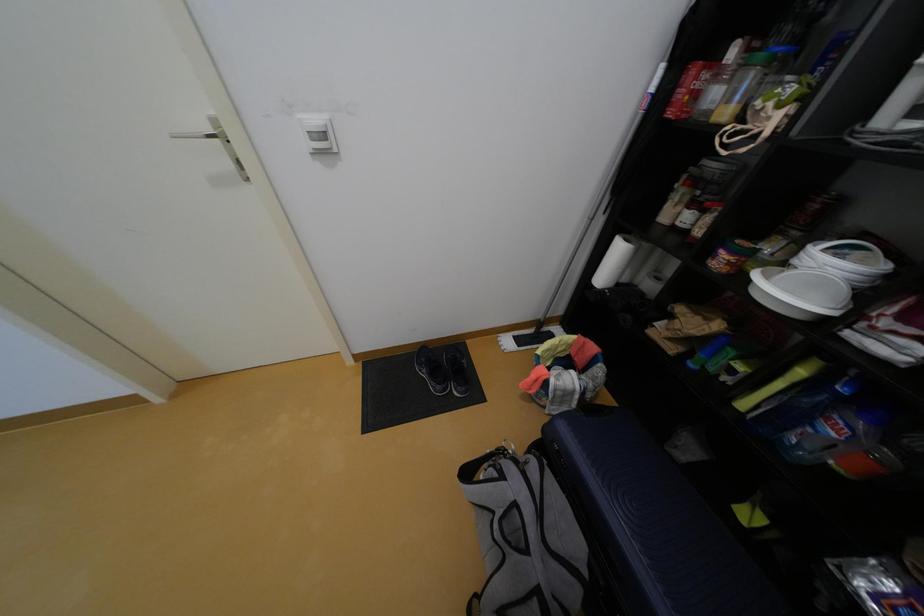
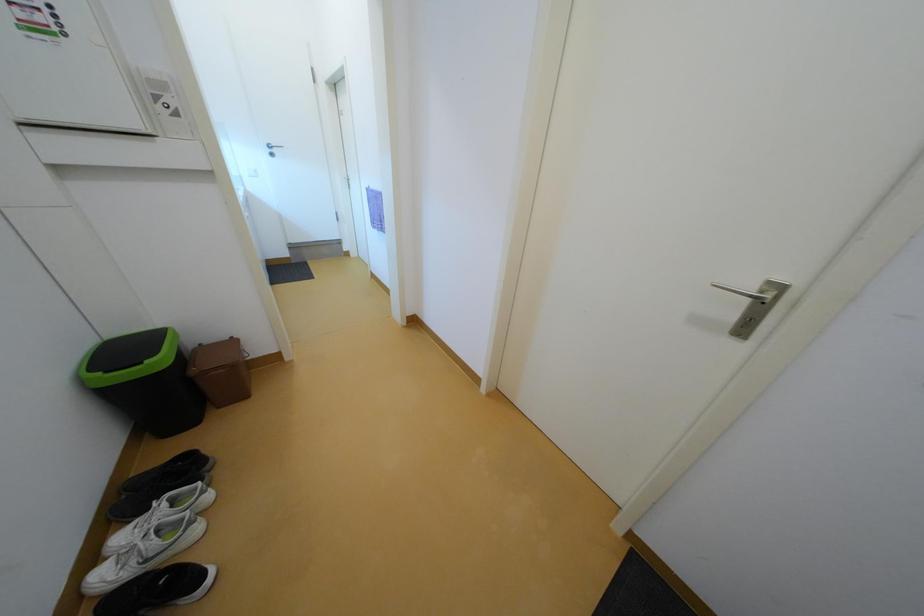
Question: How did the camera likely rotate?

Choices:
 (A) Left
 (B) Right
 (C) Up
 (D) Down

Answer: (A)